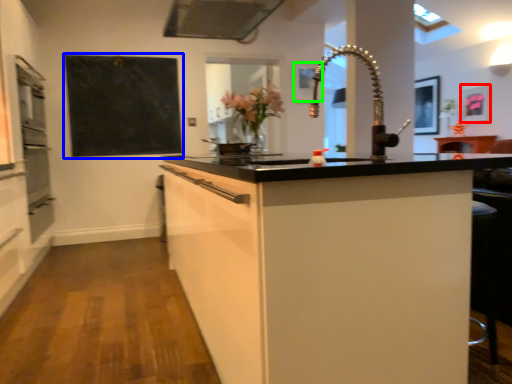
Question: Estimate the real-world distances between objects in this image. Which object is closer to picture frame (highlighted by a red box), bulletin board (highlighted by a blue box) or picture frame (highlighted by a green box)?

Choices:
 (A) bulletin board
 (B) picture frame

Answer: (B)